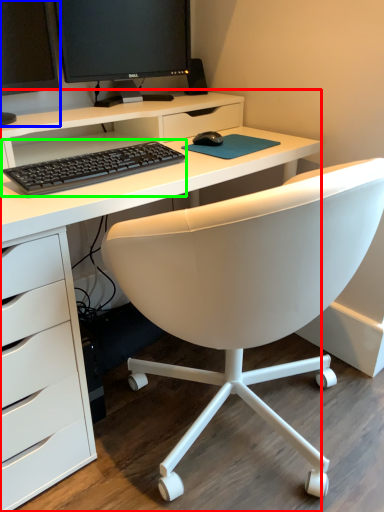
Question: Considering the real-world distances, which object is closest to desk (highlighted by a red box)? computer monitor (highlighted by a blue box) or computer keyboard (highlighted by a green box).

Choices:
 (A) computer monitor
 (B) computer keyboard

Answer: (B)